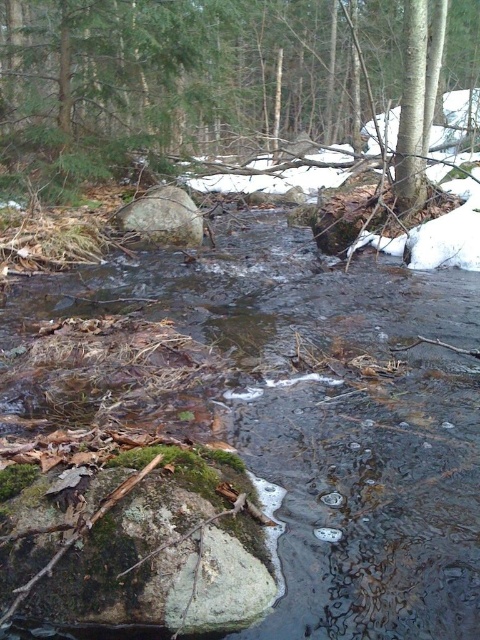
Question: Is clear water stream at center positioned in front of green mossy rock at center?

Choices:
 (A) no
 (B) yes

Answer: (B)

Question: Which of these objects is positioned closest to the gray rough boulder at center?

Choices:
 (A) clear water stream at center
 (B) green mossy rock at center

Answer: (A)

Question: Which point is closer to the camera?

Choices:
 (A) green mossy rock at center
 (B) clear water stream at center

Answer: (B)

Question: Observing the image, what is the correct spatial positioning of clear water stream at center in reference to green mossy rock at center?

Choices:
 (A) right
 (B) left

Answer: (B)

Question: Is clear water stream at center wider than gray rough boulder at center?

Choices:
 (A) yes
 (B) no

Answer: (A)

Question: Which point is closer to the camera?

Choices:
 (A) gray rough boulder at center
 (B) clear water stream at center
 (C) green mossy rock at center

Answer: (B)